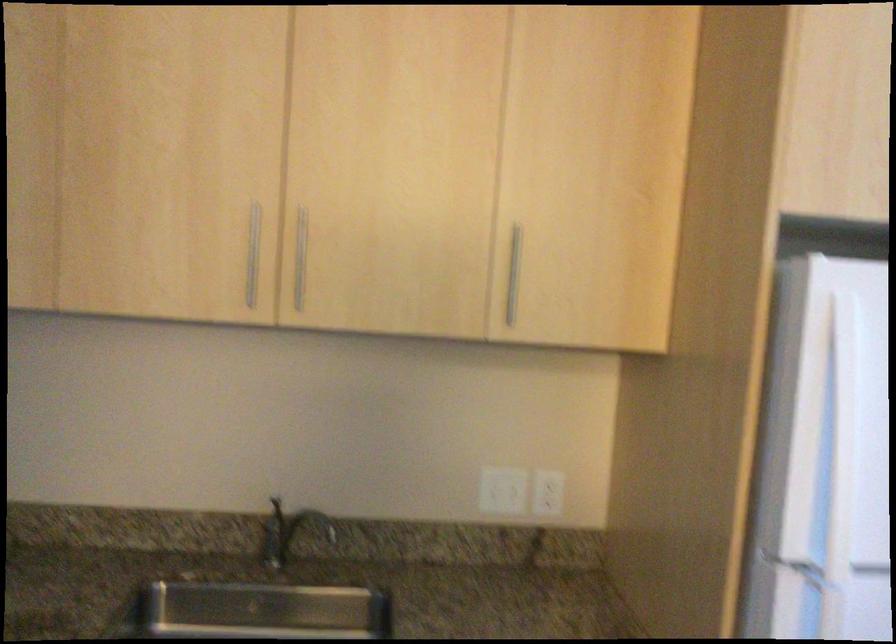
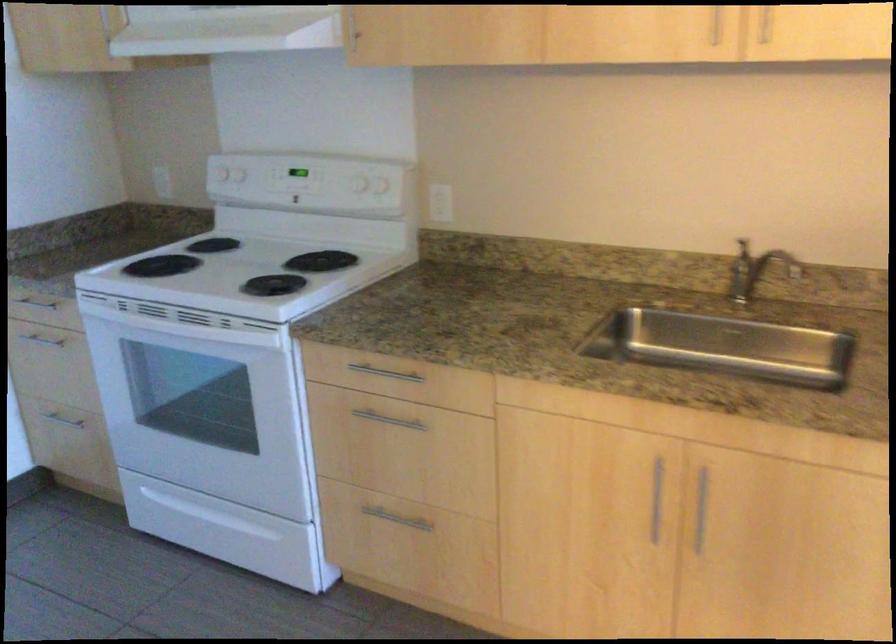
Question: The camera is either moving clockwise (left) or counter-clockwise (right) around the object. The first image is from the beginning of the video and the second image is from the end. Is the camera moving left or right when shooting the video?

Choices:
 (A) Left
 (B) Right

Answer: (B)